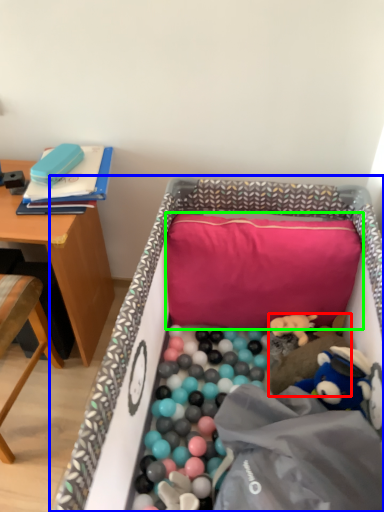
Question: Which is farther away from toy (highlighted by a red box)? infant bed (highlighted by a blue box) or pillow (highlighted by a green box)?

Choices:
 (A) infant bed
 (B) pillow

Answer: (A)